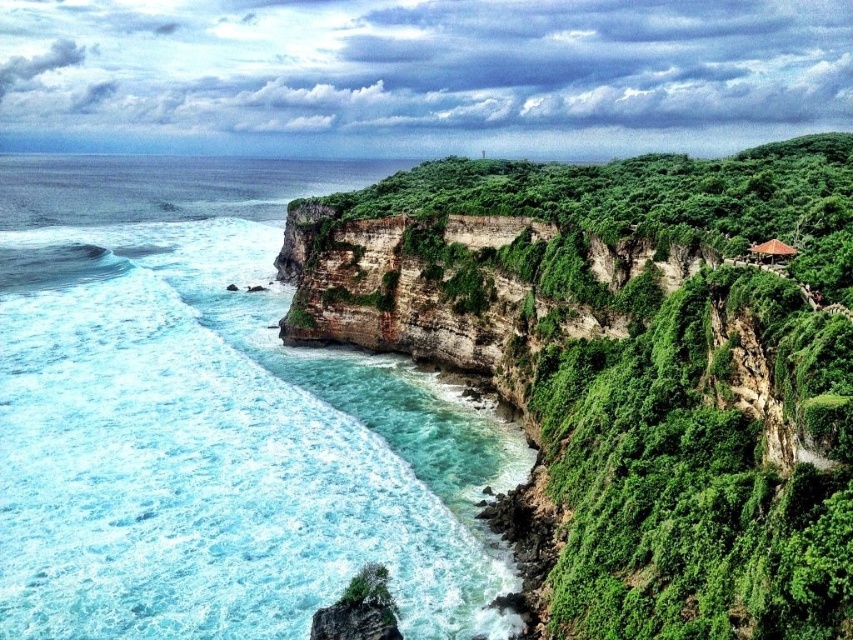
I want to click on clear blue water at left, so click(213, 420).

Is clear blue water at left wider than brown thatched hut at upper right?

Yes, clear blue water at left is wider than brown thatched hut at upper right.

Between point (398, 364) and point (761, 253), which one is positioned behind?

The point (398, 364) is more distant.

I want to click on clear blue water at left, so click(x=213, y=420).

Between point (393, 276) and point (776, 253), which one is positioned behind?

Point (393, 276)

Can you confirm if green leafy vegetation at center is thinner than brown thatched hut at upper right?

In fact, green leafy vegetation at center might be wider than brown thatched hut at upper right.

Which is in front, point (538, 596) or point (764, 257)?

Point (764, 257) is in front.

This screenshot has width=853, height=640. Find the location of `green leafy vegetation at center`. green leafy vegetation at center is located at coordinates (630, 368).

Who is more forward, [672,561] or [56,442]?

Positioned in front is point [672,561].

This screenshot has width=853, height=640. I want to click on green leafy vegetation at center, so click(630, 368).

Identify the location of green leafy vegetation at center. (630, 368).